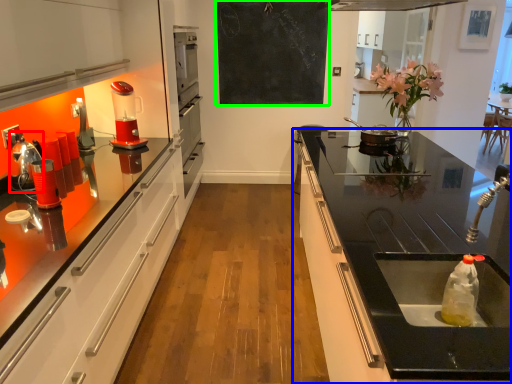
Question: Estimate the real-world distances between objects in this image. Which object is farther from appliance (highlighted by a red box), countertop (highlighted by a blue box) or bulletin board (highlighted by a green box)?

Choices:
 (A) countertop
 (B) bulletin board

Answer: (B)